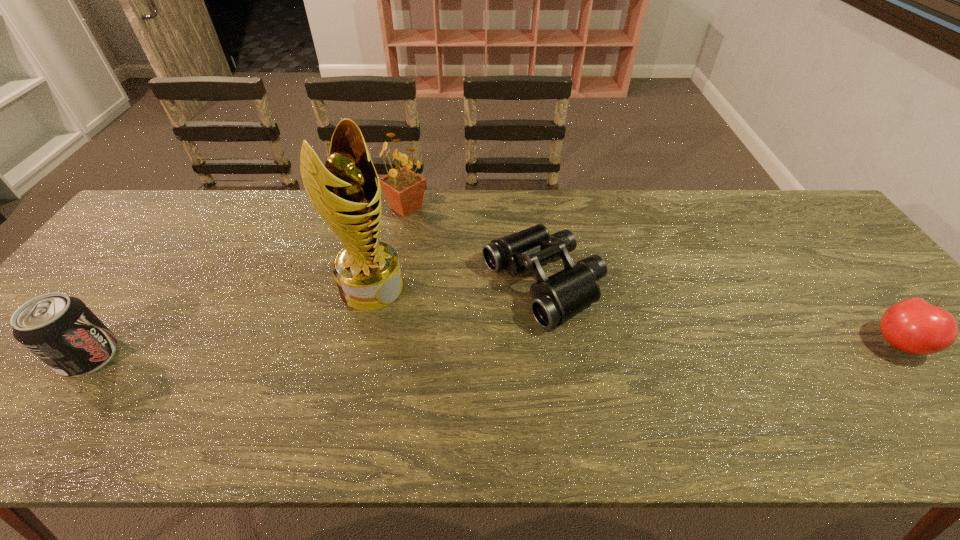
Where is `vacant space on the desktop that is between the soda can and the rightmost object and is positioned on the front-facing side of the award`? This screenshot has width=960, height=540. vacant space on the desktop that is between the soda can and the rightmost object and is positioned on the front-facing side of the award is located at coordinates (473, 350).

This screenshot has width=960, height=540. I want to click on vacant spot on the desktop that is between the soda can and the apple and is positioned on the front-facing side of the second object from right to left, so [405, 351].

I want to click on free spot on the desktop that is between the third tallest object and the apple and is positioned at the front of the farthest object with flowers visible, so click(x=381, y=352).